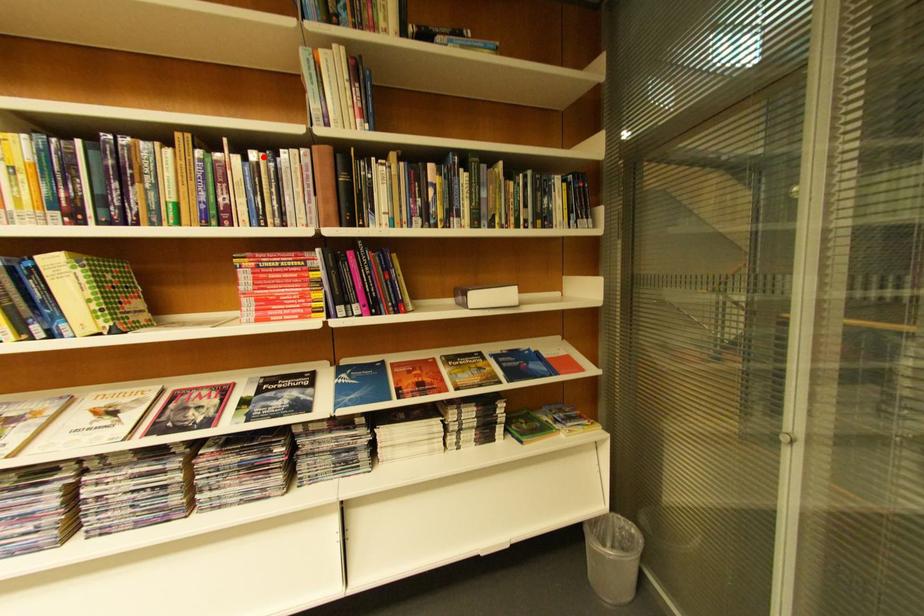
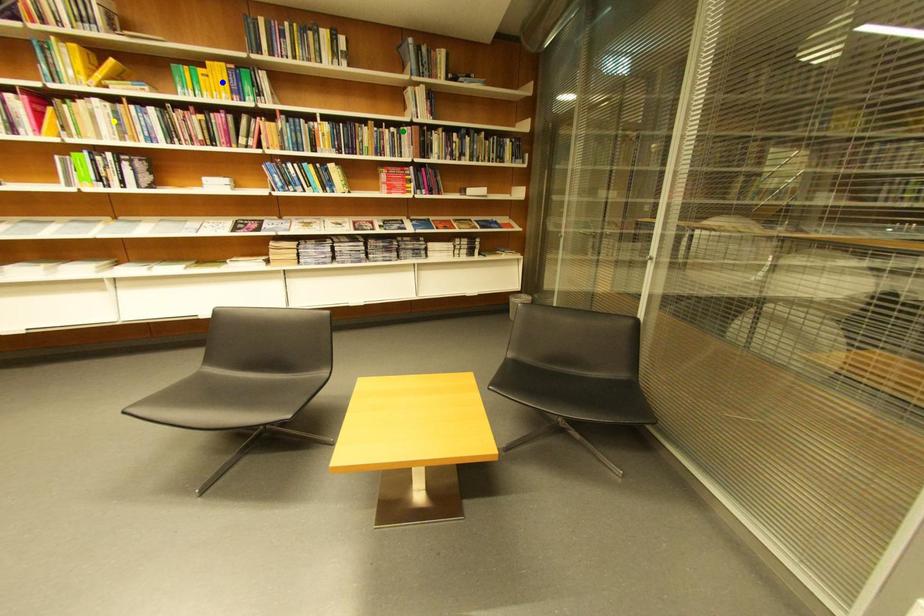
Question: I am providing you with two images of the same scene from different viewpoints. A red point is marked on the first image. You are given multiple points on the second image. Which spot in image 2 lines up with the point in image 1?

Choices:
 (A) green point
 (B) yellow point
 (C) blue point

Answer: (A)